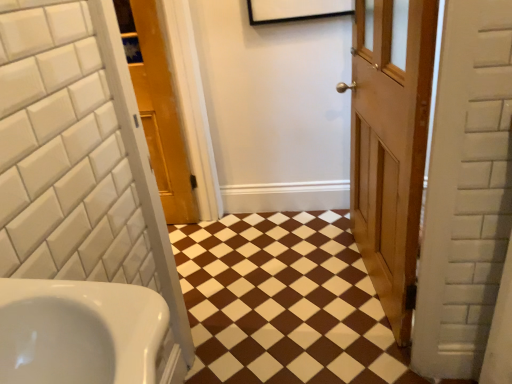
The height and width of the screenshot is (384, 512). In order to click on wooden door at center, which ranks as the second door in right-to-left order in this screenshot , I will do `click(157, 108)`.

In order to face wooden door at center, the 1th door from the left, should I rotate leftwards or rightwards?

Turn left approximately 12.781 degrees to face it.

You are a GUI agent. You are given a task and a screenshot of the screen. Output one action in this format:
    pyautogui.click(x=<x>, y=<y>)
    Task: Click on the brown glossy tile at center
    The height and width of the screenshot is (384, 512).
    Given the screenshot: What is the action you would take?
    pyautogui.click(x=283, y=302)

Which of these two, white glossy sink at lower left or wooden door at center, the 1th door from the left, is smaller?

white glossy sink at lower left.

In order to click on door that is the 2nd object located behind the white glossy sink at lower left in this screenshot , I will do `click(157, 108)`.

Measure the distance between white glossy sink at lower left and wooden door at center, the 1th door from the left.

A distance of 5.65 feet exists between white glossy sink at lower left and wooden door at center, the 1th door from the left.

Considering the relative positions of white glossy sink at lower left and wooden door at center, which ranks as the second door in right-to-left order, in the image provided, is white glossy sink at lower left in front of wooden door at center, which ranks as the second door in right-to-left order,?

Yes, white glossy sink at lower left is closer to the camera.

From the image's perspective, between brown glossy tile at center and white glossy sink at lower left, who is located below?

brown glossy tile at center is shown below in the image.

Considering the positions of objects brown glossy tile at center and white glossy sink at lower left in the image provided, who is more to the left, brown glossy tile at center or white glossy sink at lower left?

white glossy sink at lower left.

Between brown glossy tile at center and white glossy sink at lower left, which one has larger size?

brown glossy tile at center is bigger.

Is white glossy sink at lower left completely or partially inside brown glossy tile at center?

That's incorrect, white glossy sink at lower left is not inside brown glossy tile at center.

Which is behind, wooden door at center, the 1th door when ordered from right to left, or white glossy sink at lower left?

wooden door at center, the 1th door when ordered from right to left.

Considering the relative sizes of wooden door at center, the 1th door when ordered from right to left, and white glossy sink at lower left in the image provided, is wooden door at center, the 1th door when ordered from right to left, wider than white glossy sink at lower left?

Incorrect, the width of wooden door at center, the 1th door when ordered from right to left, does not surpass that of white glossy sink at lower left.

In terms of size, does wooden door at center, the 1th door when ordered from right to left, appear bigger or smaller than white glossy sink at lower left?

In the image, wooden door at center, the 1th door when ordered from right to left, appears to be larger than white glossy sink at lower left.

Considering the sizes of objects wooden door at center, which ranks as the 2th door in left-to-right order, and white glossy sink at lower left in the image provided, who is shorter, wooden door at center, which ranks as the 2th door in left-to-right order, or white glossy sink at lower left?

With less height is white glossy sink at lower left.

Which is in front, point (324, 222) or point (152, 76)?

The point (152, 76) is closer to the camera.

From the image's perspective, which object appears higher, brown glossy tile at center or wooden door at center, the 1th door from the left?

wooden door at center, the 1th door from the left.

Are brown glossy tile at center and wooden door at center, the 1th door from the left, far apart?

Actually, brown glossy tile at center and wooden door at center, the 1th door from the left, are a little close together.

From a real-world perspective, who is located higher, white glossy sink at lower left or wooden door at center, the 1th door when ordered from right to left?

white glossy sink at lower left.

Considering the points (90, 381) and (411, 235), which point is in front, point (90, 381) or point (411, 235)?

The point (90, 381) is closer.

How different are the orientations of white glossy sink at lower left and wooden door at center, which ranks as the 2th door in left-to-right order, in degrees?

169 degrees.

Is white glossy sink at lower left aimed at wooden door at center, the 1th door when ordered from right to left?

No, white glossy sink at lower left is not oriented towards wooden door at center, the 1th door when ordered from right to left.

Which is farther from the camera, (166, 84) or (238, 313)?

The point (166, 84) is farther from the camera.

Is brown glossy tile at center surrounded by wooden door at center, the 1th door from the left?

That's incorrect, brown glossy tile at center is not inside wooden door at center, the 1th door from the left.

Considering the relative sizes of wooden door at center, which ranks as the second door in right-to-left order, and brown glossy tile at center in the image provided, is wooden door at center, which ranks as the second door in right-to-left order, smaller than brown glossy tile at center?

No, wooden door at center, which ranks as the second door in right-to-left order, is not smaller than brown glossy tile at center.

From a real-world perspective, is wooden door at center, which ranks as the second door in right-to-left order, on top of brown glossy tile at center?

Yes.

Can you confirm if wooden door at center, which ranks as the second door in right-to-left order, is wider than white glossy sink at lower left?

In fact, wooden door at center, which ranks as the second door in right-to-left order, might be narrower than white glossy sink at lower left.

Between wooden door at center, the 1th door from the left, and white glossy sink at lower left, which one appears on the left side from the viewer's perspective?

From the viewer's perspective, wooden door at center, the 1th door from the left, appears more on the left side.

Is wooden door at center, which ranks as the second door in right-to-left order, next to white glossy sink at lower left and touching it?

They are not placed beside each other.

You are a GUI agent. You are given a task and a screenshot of the screen. Output one action in this format:
    pyautogui.click(x=<x>, y=<y>)
    Task: Click on the sink in front of the wooden door at center, which ranks as the second door in right-to-left order
    The width and height of the screenshot is (512, 384).
    Given the screenshot: What is the action you would take?
    pyautogui.click(x=79, y=332)

The width and height of the screenshot is (512, 384). What are the coordinates of `square that appears below the white glossy sink at lower left (from the image's perspective)` in the screenshot? It's located at (283, 302).

Considering their positions, is white glossy sink at lower left positioned closer to wooden door at center, which ranks as the 2th door in left-to-right order, than wooden door at center, the 1th door from the left?

The object closer to wooden door at center, which ranks as the 2th door in left-to-right order, is wooden door at center, the 1th door from the left.

Which object lies nearer to the anchor point wooden door at center, which ranks as the 2th door in left-to-right order, brown glossy tile at center or white glossy sink at lower left?

Based on the image, brown glossy tile at center appears to be nearer to wooden door at center, which ranks as the 2th door in left-to-right order.

Considering their positions, is white glossy sink at lower left positioned further to wooden door at center, the 1th door from the left, than wooden door at center, the 1th door when ordered from right to left?

Based on the image, white glossy sink at lower left appears to be further to wooden door at center, the 1th door from the left.

Which object lies further to the anchor point white glossy sink at lower left, wooden door at center, which ranks as the 2th door in left-to-right order, or brown glossy tile at center?

brown glossy tile at center is further to white glossy sink at lower left.

Which object lies nearer to the anchor point white glossy sink at lower left, wooden door at center, the 1th door from the left, or brown glossy tile at center?

brown glossy tile at center is closer to white glossy sink at lower left.

Looking at the image, which one is located closer to brown glossy tile at center, wooden door at center, the 1th door from the left, or white glossy sink at lower left?

Based on the image, wooden door at center, the 1th door from the left, appears to be nearer to brown glossy tile at center.

Looking at the image, which one is located closer to wooden door at center, which ranks as the 2th door in left-to-right order, brown glossy tile at center or wooden door at center, which ranks as the second door in right-to-left order?

brown glossy tile at center is closer to wooden door at center, which ranks as the 2th door in left-to-right order.

Considering their positions, is wooden door at center, the 1th door from the left, positioned further to white glossy sink at lower left than wooden door at center, which ranks as the 2th door in left-to-right order?

Based on the image, wooden door at center, the 1th door from the left, appears to be further to white glossy sink at lower left.

Locate an element on the screen. The width and height of the screenshot is (512, 384). door located between white glossy sink at lower left and brown glossy tile at center in the depth direction is located at coordinates (390, 144).

Locate an element on the screen. square between white glossy sink at lower left and wooden door at center, which ranks as the second door in right-to-left order, in the front-back direction is located at coordinates (283, 302).

Where is `square between wooden door at center, which ranks as the second door in right-to-left order, and wooden door at center, the 1th door when ordered from right to left`? Image resolution: width=512 pixels, height=384 pixels. square between wooden door at center, which ranks as the second door in right-to-left order, and wooden door at center, the 1th door when ordered from right to left is located at coordinates (283, 302).

Identify the location of door between white glossy sink at lower left and wooden door at center, which ranks as the second door in right-to-left order, along the z-axis. The width and height of the screenshot is (512, 384). (390, 144).